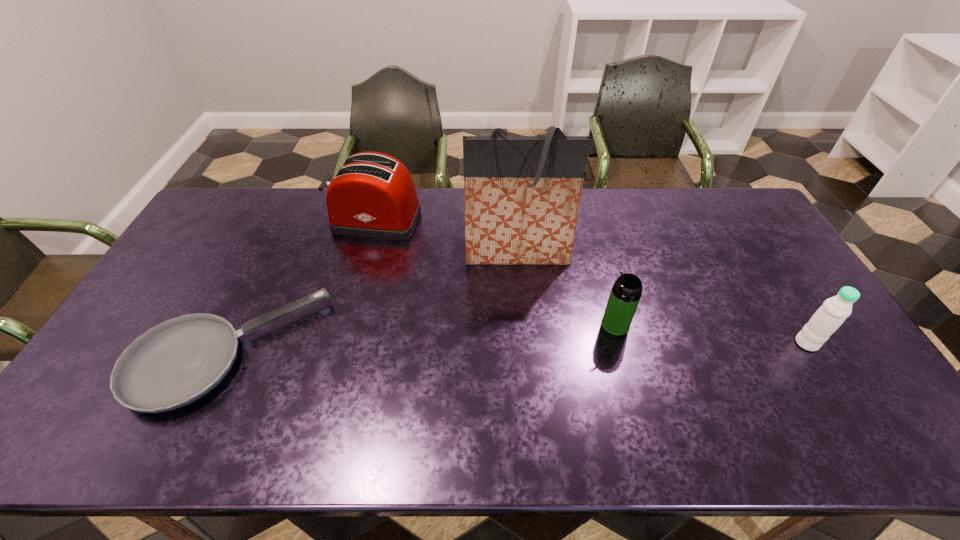
The image size is (960, 540). In order to click on the third object from left to right in this screenshot , I will do [x=522, y=194].

Locate an element on the screen. The width and height of the screenshot is (960, 540). shopping bag is located at coordinates (522, 194).

The image size is (960, 540). Find the location of `toaster`. toaster is located at coordinates (372, 195).

I want to click on the rightmost object, so click(x=828, y=318).

This screenshot has height=540, width=960. I want to click on the second object from right to left, so click(626, 292).

This screenshot has width=960, height=540. Find the location of `frying pan`. frying pan is located at coordinates (173, 364).

Find the location of a particular element. This screenshot has width=960, height=540. vacant area situated 0.050m on the front-facing side of the shopping bag is located at coordinates (520, 285).

I want to click on vacant space located on the right of the toaster, so click(x=445, y=220).

You are a GUI agent. You are given a task and a screenshot of the screen. Output one action in this format:
    pyautogui.click(x=<x>, y=<y>)
    Task: Click on the free space located 0.200m on the left of the water bottle
    The image size is (960, 540).
    Given the screenshot: What is the action you would take?
    pyautogui.click(x=722, y=343)

Identify the location of free spot located 0.170m from the spout of the fourth object from left to right. (540, 325).